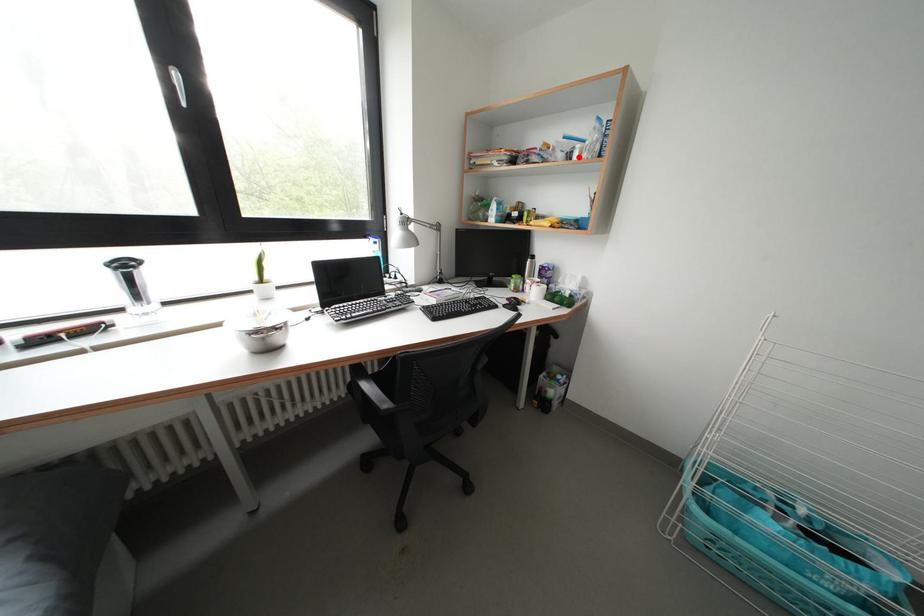
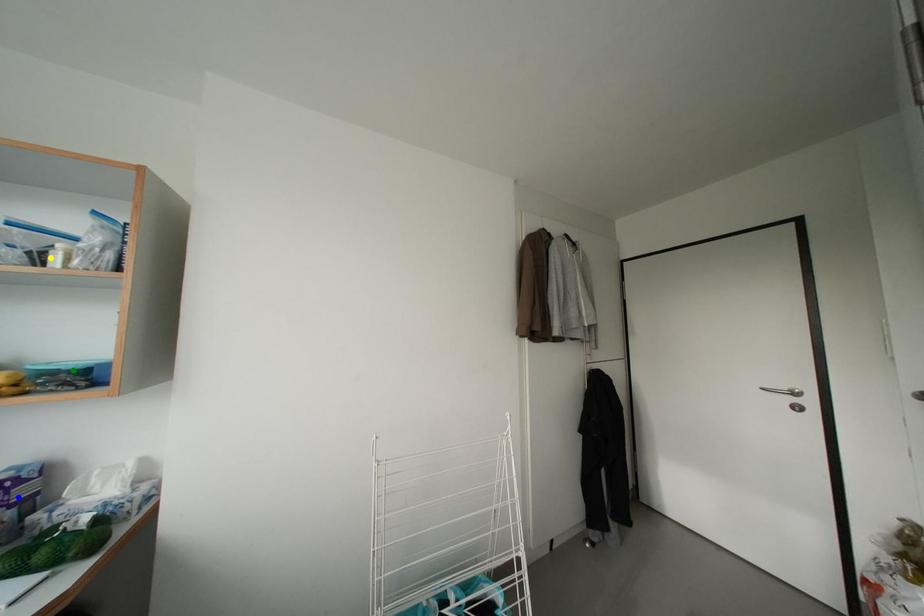
Question: I am providing you with two images of the same scene from different viewpoints. A red point is marked on the first image. You are given multiple points on the second image. Can you choose the point in image 2 that corresponds to the point in image 1?

Choices:
 (A) blue point
 (B) green point
 (C) yellow point

Answer: (C)